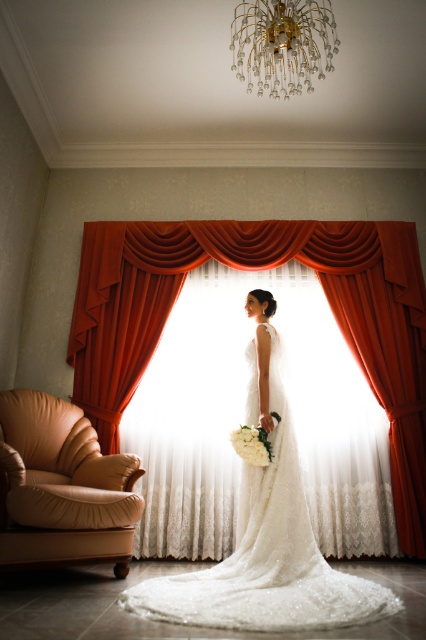
You are a photographer setting up for the wedding photoshoot. You need to position the bride so that she is standing exactly in front of the matte orange curtain at center. Based on the scene description, where should the bride be positioned relative to the window and the other curtains?

The matte orange curtain at center is located at point (261, 268), so the bride should position herself directly in front of this curtain, which is centrally placed between the deep red curtains and the sheer white lace curtains at the window.

You are a photographer setting up for a wedding photo shoot. The bride is standing by the large window with deep red curtains. You need to position a small table with a floral arrangement near the tan leather armchair at lower left. Can you place the table at the point marked by coordinates point (62, 486)? Explain why or why not based on the scene description.

The point (62, 486) is located on the tan leather armchair at lower left. Since the armchair is already occupying that space, placing the table there would not be possible as it would interfere with the armchair.